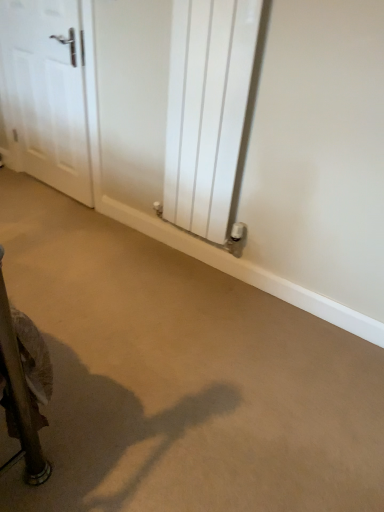
Question: Does white metallic radiator at center have a smaller size compared to white glossy door at upper left?

Choices:
 (A) yes
 (B) no

Answer: (B)

Question: Does white metallic radiator at center have a lesser height compared to white glossy door at upper left?

Choices:
 (A) no
 (B) yes

Answer: (A)

Question: Is white metallic radiator at center in contact with white glossy door at upper left?

Choices:
 (A) yes
 (B) no

Answer: (B)

Question: From the image's perspective, is white metallic radiator at center on top of white glossy door at upper left?

Choices:
 (A) yes
 (B) no

Answer: (B)

Question: Can you confirm if white metallic radiator at center is taller than white glossy door at upper left?

Choices:
 (A) yes
 (B) no

Answer: (A)

Question: Can you confirm if white metallic radiator at center is thinner than white glossy door at upper left?

Choices:
 (A) no
 (B) yes

Answer: (A)

Question: From a real-world perspective, is white glossy door at upper left positioned under beige carpet at center based on gravity?

Choices:
 (A) yes
 (B) no

Answer: (B)

Question: From a real-world perspective, is white glossy door at upper left on beige carpet at center?

Choices:
 (A) yes
 (B) no

Answer: (A)

Question: Is white glossy door at upper left behind beige carpet at center?

Choices:
 (A) no
 (B) yes

Answer: (B)

Question: Is white glossy door at upper left smaller than beige carpet at center?

Choices:
 (A) no
 (B) yes

Answer: (B)

Question: Does white glossy door at upper left contain beige carpet at center?

Choices:
 (A) no
 (B) yes

Answer: (A)

Question: Could you tell me if white glossy door at upper left is facing beige carpet at center?

Choices:
 (A) no
 (B) yes

Answer: (A)

Question: Considering the relative sizes of beige carpet at center and white glossy door at upper left in the image provided, is beige carpet at center smaller than white glossy door at upper left?

Choices:
 (A) no
 (B) yes

Answer: (A)